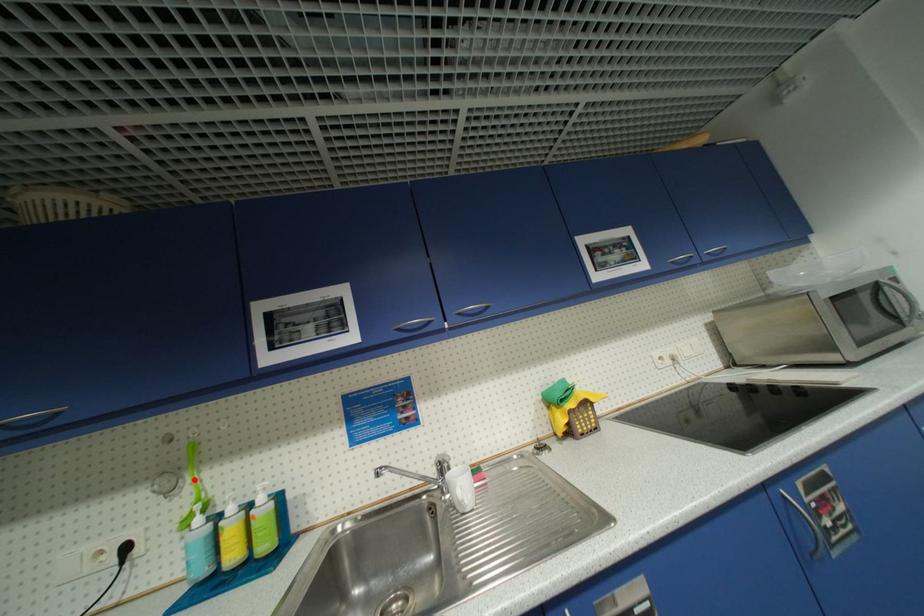
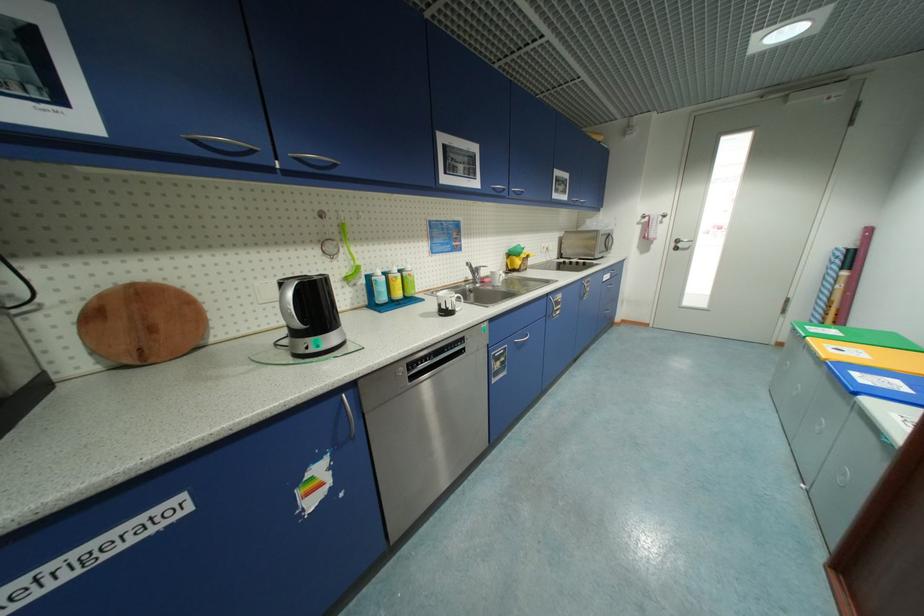
The point at the highlighted location is marked in the first image. Where is the corresponding point in the second image?

(347, 251)